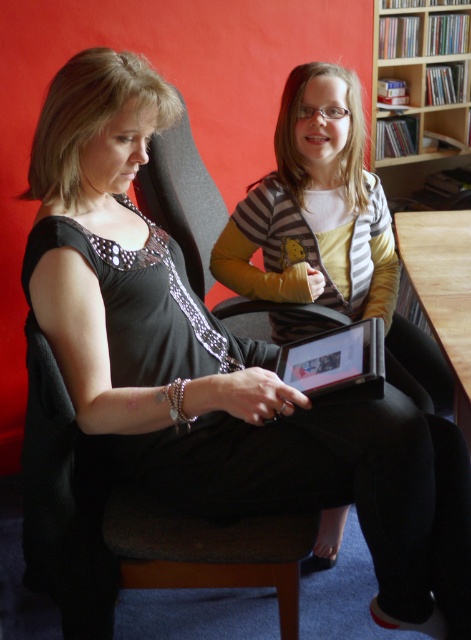
You are trying to decide which item is taller between the striped sweater at center and the black plastic tablet at center. Based on the scene description, which one is taller?

The striped sweater at center is taller than the black plastic tablet at center according to the description.